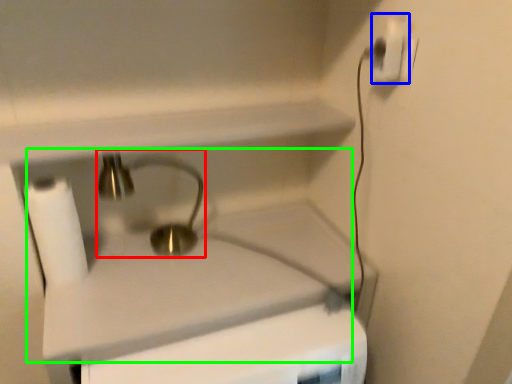
Question: Which object is the closest to the faucet (highlighted by a red box)? Choose among these: power plugs and sockets (highlighted by a blue box) or sink (highlighted by a green box).

Choices:
 (A) power plugs and sockets
 (B) sink

Answer: (B)